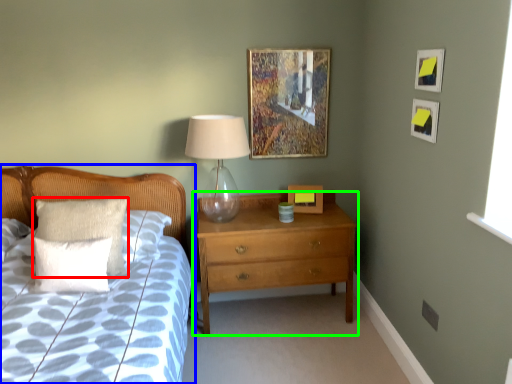
Question: Estimate the real-world distances between objects in this image. Which object is closer to pillow (highlighted by a red box), bed (highlighted by a blue box) or chest of drawers (highlighted by a green box)?

Choices:
 (A) bed
 (B) chest of drawers

Answer: (A)